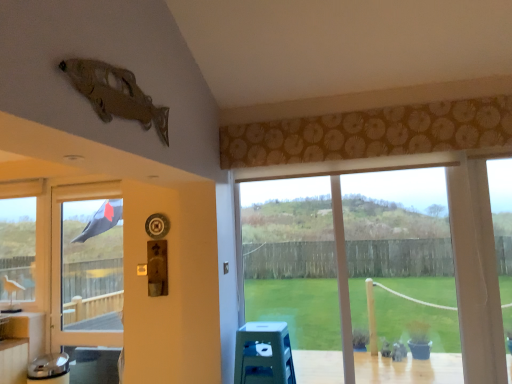
In order to face black fabric screen door at left, should I rotate leftwards or rightwards?

Rotate your view left by about 21.680°.

Describe the element at coordinates (263, 354) in the screenshot. This screenshot has height=384, width=512. I see `blue plastic stool at lower center` at that location.

Locate an element on the screen. This screenshot has height=384, width=512. black fabric screen door at left is located at coordinates (87, 264).

Can you confirm if black fabric screen door at left is shorter than transparent glass window at center, the 1th window when ordered from front to back?

No.

Can you confirm if black fabric screen door at left is positioned to the left of transparent glass window at center, positioned as the 1th window in right-to-left order?

Indeed, black fabric screen door at left is positioned on the left side of transparent glass window at center, positioned as the 1th window in right-to-left order.

Measure the distance between black fabric screen door at left and transparent glass window at center, the second window viewed from the back.

A distance of 1.72 meters exists between black fabric screen door at left and transparent glass window at center, the second window viewed from the back.

From a real-world perspective, is black fabric screen door at left located higher than transparent glass window at center, the 1th window when ordered from front to back?

No, from a real-world perspective, black fabric screen door at left is not over transparent glass window at center, the 1th window when ordered from front to back

From a real-world perspective, which object rests below the other?

blue plastic stool at lower center.

The height and width of the screenshot is (384, 512). Find the location of `the 2nd window behind the blue plastic stool at lower center, counting from the anchor's position`. the 2nd window behind the blue plastic stool at lower center, counting from the anchor's position is located at coordinates (17, 248).

Is clear glass window at left, which is the 2th window from right to left, situated inside blue plastic stool at lower center or outside?

clear glass window at left, which is the 2th window from right to left, is not inside blue plastic stool at lower center, it's outside.

Is clear glass window at left, arranged as the 1th window when viewed from the back, facing away from blue plastic stool at lower center?

No, clear glass window at left, arranged as the 1th window when viewed from the back,'s orientation is not away from blue plastic stool at lower center.

Looking at this image, from a real-world perspective, which object stands above the other?

From a 3D spatial view, clear glass window at left, which is the 2th window from right to left, is above.

Identify the location of window behind the black fabric screen door at left. (17, 248).

Based on the photo, does black fabric screen door at left have a larger size compared to clear glass window at left, arranged as the 1th window when viewed from the back?

No.

Would you say black fabric screen door at left is to the left or to the right of clear glass window at left, which is the 2th window from right to left, in the picture?

From the image, it's evident that black fabric screen door at left is to the right of clear glass window at left, which is the 2th window from right to left.

Who is smaller, blue plastic stool at lower center or transparent glass window at center, positioned as the 1th window in right-to-left order?

blue plastic stool at lower center.

Considering their positions, is blue plastic stool at lower center located in front of or behind transparent glass window at center, marked as the second window in a left-to-right arrangement?

blue plastic stool at lower center is positioned closer to the viewer than transparent glass window at center, marked as the second window in a left-to-right arrangement.

Find the location of `the 1st window above the blue plastic stool at lower center (from the image's perspective)`. the 1st window above the blue plastic stool at lower center (from the image's perspective) is located at coordinates (343, 247).

How many degrees apart are the facing directions of blue plastic stool at lower center and transparent glass window at center, marked as the second window in a left-to-right arrangement?

The angle between the facing direction of blue plastic stool at lower center and the facing direction of transparent glass window at center, marked as the second window in a left-to-right arrangement, is 93.2 degrees.

Is blue plastic stool at lower center oriented towards clear glass window at left, the first window positioned from the left?

Yes.

From the image's perspective, is blue plastic stool at lower center below clear glass window at left, which is the 2th window from right to left?

Yes, from the image's perspective, blue plastic stool at lower center is below clear glass window at left, which is the 2th window from right to left.

Does blue plastic stool at lower center have a larger size compared to clear glass window at left, the first window positioned from the left?

No.

Is clear glass window at left, arranged as the 1th window when viewed from the back, spatially inside black fabric screen door at left, or outside of it?

clear glass window at left, arranged as the 1th window when viewed from the back, is not inside black fabric screen door at left, it's outside.

Considering the sizes of clear glass window at left, arranged as the second window when viewed from the front, and black fabric screen door at left in the image, is clear glass window at left, arranged as the second window when viewed from the front, wider or thinner than black fabric screen door at left?

Considering their sizes, clear glass window at left, arranged as the second window when viewed from the front, looks broader than black fabric screen door at left.

Which point is more distant from viewer, (5, 274) or (62, 309)?

A: The point (5, 274) is farther.

What's the angular difference between clear glass window at left, arranged as the second window when viewed from the front, and black fabric screen door at left's facing directions?

2.36 degrees.

Consider the image. From a real-world perspective, is clear glass window at left, arranged as the 1th window when viewed from the back, located higher than transparent glass window at center, marked as the second window in a left-to-right arrangement?

Yes.

How many degrees apart are the facing directions of clear glass window at left, the first window positioned from the left, and transparent glass window at center, the 1th window when ordered from front to back?

The facing directions of clear glass window at left, the first window positioned from the left, and transparent glass window at center, the 1th window when ordered from front to back, are 2.16 degrees apart.

I want to click on window that appears on the left of transparent glass window at center, the 1th window when ordered from front to back, so click(x=17, y=248).

Which point is more distant from viewer, (x=19, y=221) or (x=364, y=312)?

The point (x=19, y=221) is farther.

The height and width of the screenshot is (384, 512). I want to click on screen door that appears behind the transparent glass window at center, the second window viewed from the back, so click(x=87, y=264).

Where is `stool to the right of clear glass window at left, the first window positioned from the left`? stool to the right of clear glass window at left, the first window positioned from the left is located at coordinates (263, 354).

When comparing their distances from blue plastic stool at lower center, does clear glass window at left, arranged as the second window when viewed from the front, or black fabric screen door at left seem closer?

black fabric screen door at left.

Estimate the real-world distances between objects in this image. Which object is closer to clear glass window at left, which is the 2th window from right to left, transparent glass window at center, the 1th window when ordered from front to back, or blue plastic stool at lower center?

blue plastic stool at lower center is positioned closer to the anchor clear glass window at left, which is the 2th window from right to left.

From the image, which object appears to be nearer to blue plastic stool at lower center, transparent glass window at center, positioned as the 1th window in right-to-left order, or clear glass window at left, the first window positioned from the left?

transparent glass window at center, positioned as the 1th window in right-to-left order.

Based on their spatial positions, is black fabric screen door at left or clear glass window at left, the first window positioned from the left, closer to blue plastic stool at lower center?

black fabric screen door at left.

Estimate the real-world distances between objects in this image. Which object is closer to clear glass window at left, arranged as the 1th window when viewed from the back, black fabric screen door at left or blue plastic stool at lower center?

black fabric screen door at left is closer to clear glass window at left, arranged as the 1th window when viewed from the back.

Estimate the real-world distances between objects in this image. Which object is further from black fabric screen door at left, clear glass window at left, arranged as the second window when viewed from the front, or transparent glass window at center, the 1th window when ordered from front to back?

The object further to black fabric screen door at left is transparent glass window at center, the 1th window when ordered from front to back.

When comparing their distances from blue plastic stool at lower center, does black fabric screen door at left or transparent glass window at center, the second window viewed from the back, seem further?

black fabric screen door at left.

Looking at the image, which one is located closer to clear glass window at left, arranged as the 1th window when viewed from the back, transparent glass window at center, positioned as the 1th window in right-to-left order, or black fabric screen door at left?

Based on the image, black fabric screen door at left appears to be nearer to clear glass window at left, arranged as the 1th window when viewed from the back.

This screenshot has width=512, height=384. Find the location of `screen door between clear glass window at left, arranged as the second window when viewed from the front, and blue plastic stool at lower center`. screen door between clear glass window at left, arranged as the second window when viewed from the front, and blue plastic stool at lower center is located at coordinates (87, 264).

Image resolution: width=512 pixels, height=384 pixels. In order to click on stool between clear glass window at left, the first window positioned from the left, and transparent glass window at center, the 1th window when ordered from front to back, in the horizontal direction in this screenshot , I will do `click(263, 354)`.

Identify the location of stool between black fabric screen door at left and transparent glass window at center, the second window viewed from the back. The image size is (512, 384). (263, 354).

The height and width of the screenshot is (384, 512). Find the location of `screen door between clear glass window at left, the first window positioned from the left, and transparent glass window at center, positioned as the 1th window in right-to-left order, in the horizontal direction`. screen door between clear glass window at left, the first window positioned from the left, and transparent glass window at center, positioned as the 1th window in right-to-left order, in the horizontal direction is located at coordinates (87, 264).